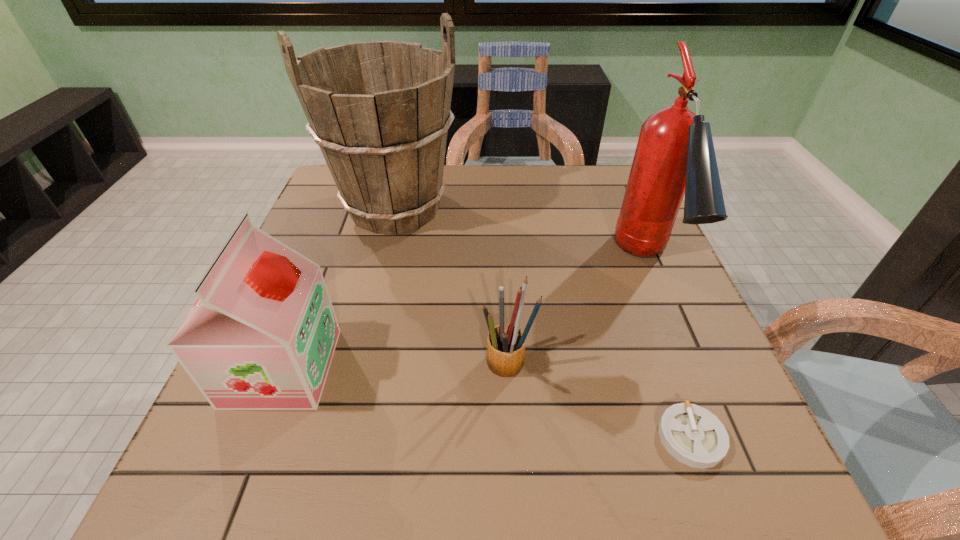
Image resolution: width=960 pixels, height=540 pixels. What are the coordinates of `free location that satisfies the following two spatial constraints: 1. on the front side of the bucket; 2. with the cap open on the third shortest object` in the screenshot? It's located at (356, 367).